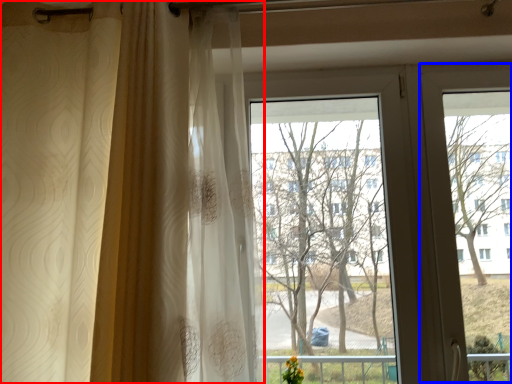
Question: Which point is further to the camera, curtain (highlighted by a red box) or screen door (highlighted by a blue box)?

Choices:
 (A) curtain
 (B) screen door

Answer: (B)